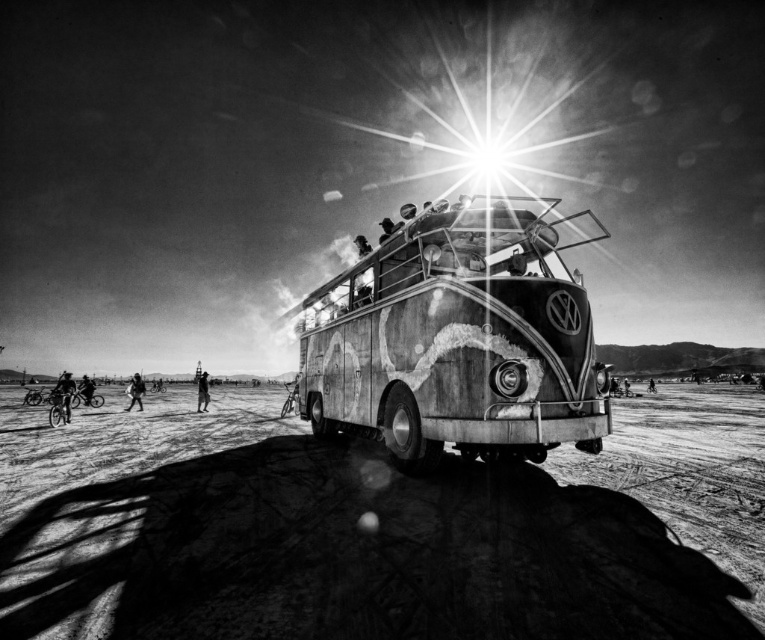
Between dusty sand at center and rusty metal van at center, which one has less height?

rusty metal van at center

Is point (291, 422) farther from camera compared to point (438, 371)?

Yes, it is.

What are the coordinates of `dusty sand at center` in the screenshot? It's located at (373, 531).

At what (x,y) coordinates should I click in order to perform the action: click on dusty sand at center. Please return your answer as a coordinate pair (x, y). Looking at the image, I should click on (373, 531).

Can you confirm if distressed denim pants at center is thinner than dark fabric bicycle at lower left?

Yes, distressed denim pants at center is thinner than dark fabric bicycle at lower left.

In the scene shown: Between distressed denim pants at center and dark fabric bicycle at lower left, which one has more height?

dark fabric bicycle at lower left is taller.

Is point (200, 396) more distant than point (93, 392)?

No, (200, 396) is in front of (93, 392).

This screenshot has height=640, width=765. Find the location of `distressed denim pants at center`. distressed denim pants at center is located at coordinates (202, 392).

Can you confirm if rusty metal van at center is positioned below dark skin bicycle rider at lower left?

No, rusty metal van at center is not below dark skin bicycle rider at lower left.

Find the location of `rusty metal van at center`. rusty metal van at center is located at coordinates (454, 342).

Locate an element on the screen. The width and height of the screenshot is (765, 640). rusty metal van at center is located at coordinates (454, 342).